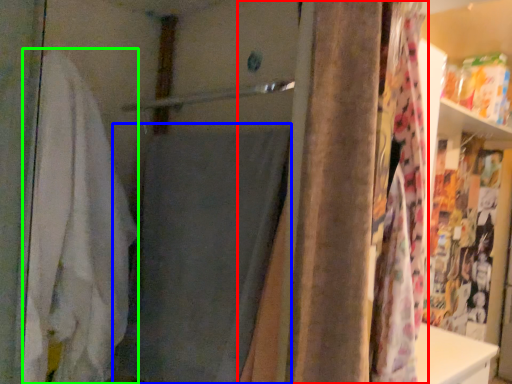
Question: Which object is positioned farthest from curtain (highlighted by a red box)? Select from bath towel (highlighted by a blue box) and bath towel (highlighted by a green box).

Choices:
 (A) bath towel
 (B) bath towel

Answer: (B)